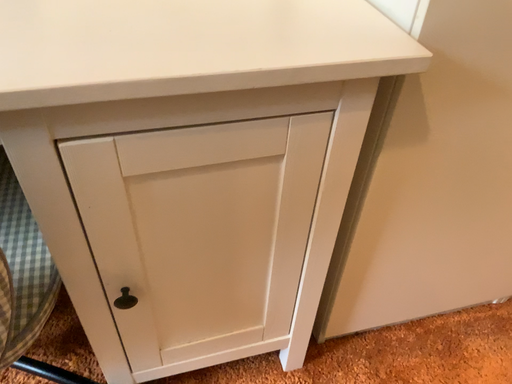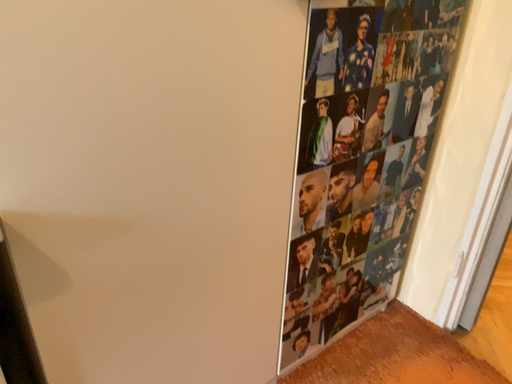
Question: How did the camera likely rotate when shooting the video?

Choices:
 (A) rotated right
 (B) rotated left

Answer: (A)